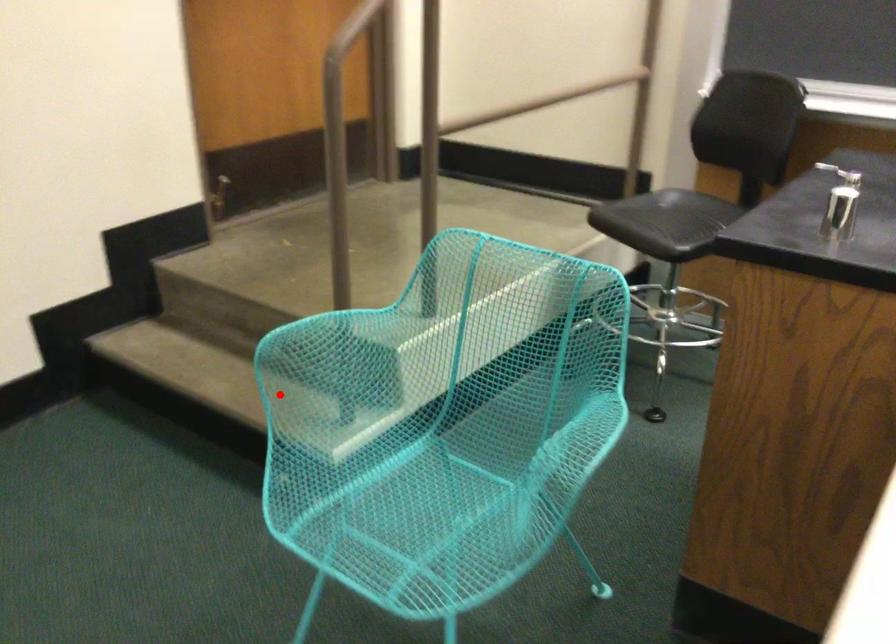
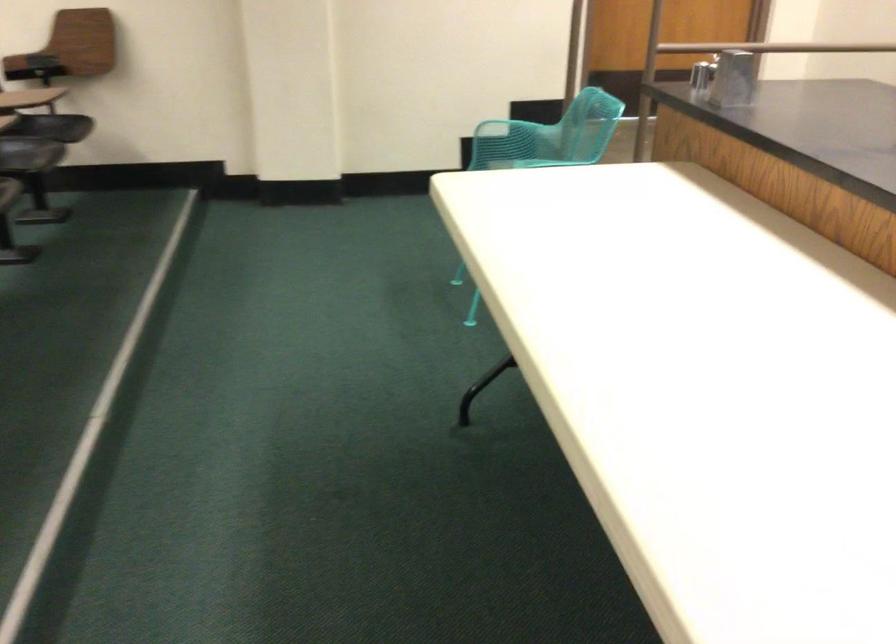
The point at the highlighted location is marked in the first image. Where is the corresponding point in the second image?

(489, 158)